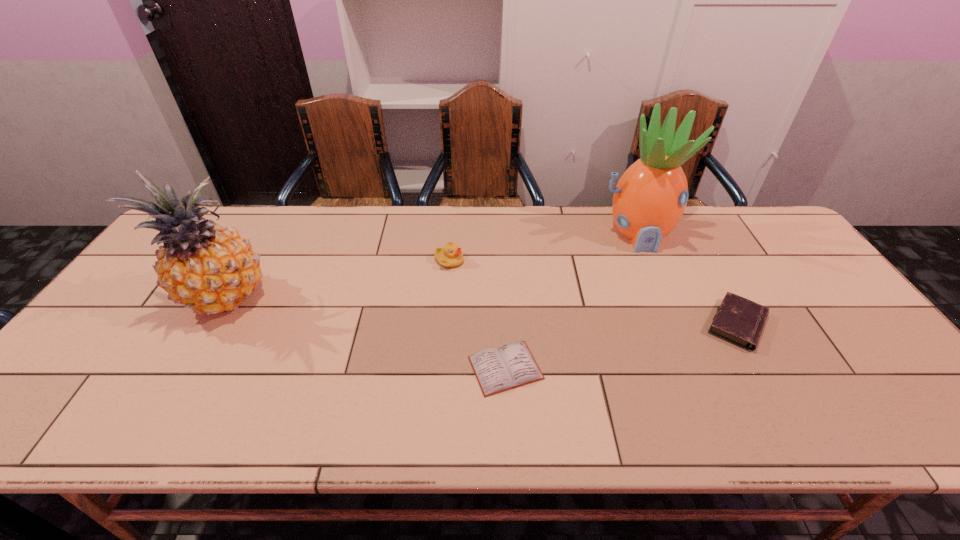
This screenshot has width=960, height=540. Identify the location of the farther pineapple. (649, 199).

Locate an element on the screen. This screenshot has width=960, height=540. the leftmost object is located at coordinates (209, 269).

The height and width of the screenshot is (540, 960). I want to click on the nearer pineapple, so click(x=209, y=269).

The image size is (960, 540). What are the coordinates of `the third tallest object` in the screenshot? It's located at (450, 256).

This screenshot has height=540, width=960. Find the location of `the second object from left to right`. the second object from left to right is located at coordinates (450, 256).

The width and height of the screenshot is (960, 540). Find the location of `the fourth tallest object`. the fourth tallest object is located at coordinates (740, 321).

Image resolution: width=960 pixels, height=540 pixels. Find the location of `the right diary`. the right diary is located at coordinates (740, 321).

Image resolution: width=960 pixels, height=540 pixels. I want to click on the third object from right to left, so click(511, 365).

The width and height of the screenshot is (960, 540). Identify the location of the shortest object. (511, 365).

You are a GUI agent. You are given a task and a screenshot of the screen. Output one action in this format:
    pyautogui.click(x=<x>, y=<y>)
    Task: Click on the vacant space located at the entrance of the farther pineapple
    The image size is (960, 540).
    Given the screenshot: What is the action you would take?
    pyautogui.click(x=659, y=285)